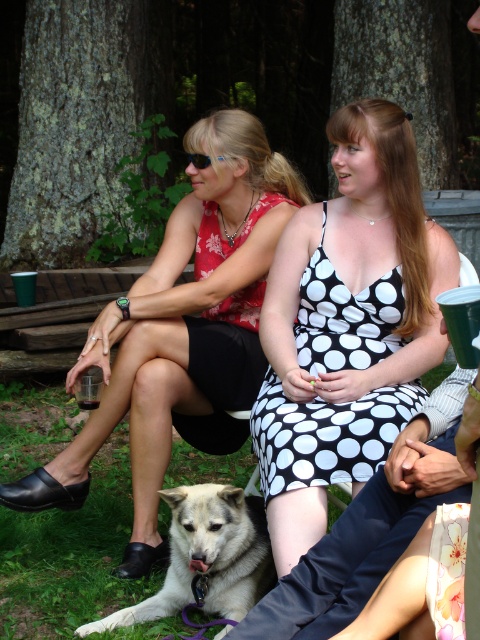
You are a photographer trying to capture a candid shot of the matte black dress at center and the white fur dog at lower left. The minimum distance your camera can focus on two subjects clearly is 60 centimeters. Based on the scene, will you be able to take a clear photo of both subjects?

The matte black dress at center is 58.59 centimeters from the white fur dog at lower left. Since this distance is less than the camera minimum focus distance of 60 centimeters, the camera cannot focus clearly on both subjects simultaneously.

You are a photographer trying to capture a candid shot of the matte black dress at center without the white fur dog at lower left appearing in the frame. Based on their positions, is it possible to position yourself in a way that the dog is out of the shot?

The white fur dog at lower left is behind the matte black dress at center, so positioning yourself in front of the matte black dress at center would block the dog from the frame, making it possible to capture the shot without the dog appearing.

You are a photographer trying to capture a clear shot of the black dotted dress at center and the white fur dog at lower left. However, the dog is partially blocking the view of the dress. Based on the scene description, can you adjust your position to ensure both subjects are visible without obstruction?

The white fur dog at lower left is behind the black dotted dress at center, so moving your camera angle slightly forward or to the side should allow you to capture both subjects without the dog obstructing the dress.